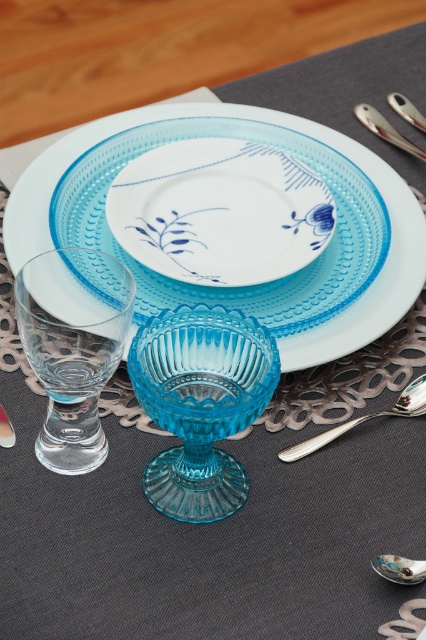
From the picture: You are setting up a table and need to place the transparent glass bowl at center and the silver metallic spoon at lower right. Which object has a smaller width?

The transparent glass bowl at center has a lesser width compared to the silver metallic spoon at lower right.

You are a server at a restaurant and need to place the silver metallic spoon at lower right into the transparent glass bowl at center. Can you fit the spoon inside the bowl?

The transparent glass bowl at center has a larger size compared to silver metallic spoon at lower right, so yes, the spoon can fit inside the bowl.

From the picture: You are a server at a restaurant and need to place a dessert on the transparent glass platter at center and the blue porcelain plate at center. Which one should you place the dessert on top of to ensure it stays visible?

You should place the dessert on top of the blue porcelain plate at center because the transparent glass platter at center is positioned over it, allowing the dessert to remain visible through the glass.